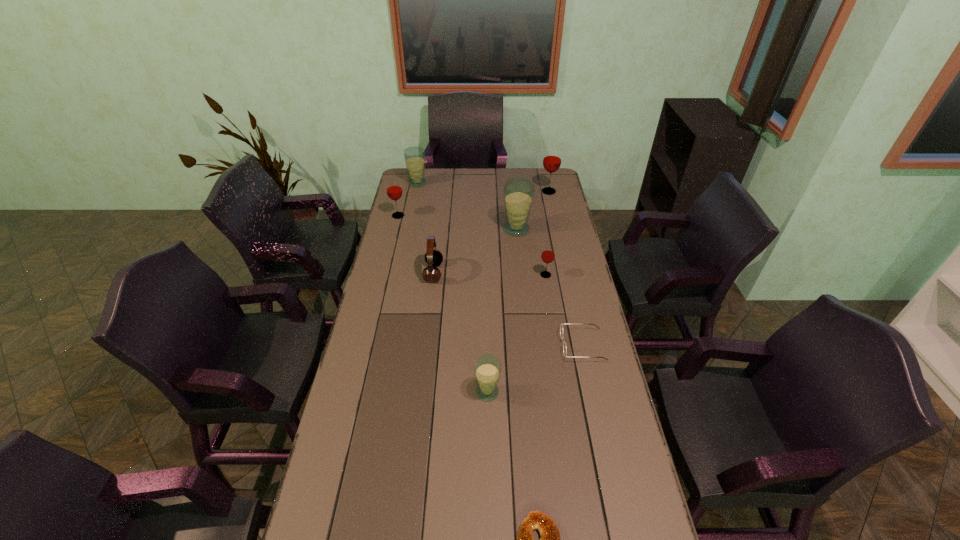
Image resolution: width=960 pixels, height=540 pixels. I want to click on glass that stands as the third closest to the second biggest blue glass, so click(552, 158).

Identify which glass is located as the fifth nearest to the spectacles. Please provide its 2D coordinates. Your answer should be formatted as a tuple, i.e. [(x, y)], where the tuple contains the x and y coordinates of a point satisfying the conditions above.

[(394, 191)]

The width and height of the screenshot is (960, 540). What are the coordinates of `red glass that is the nearest to the farthest red glass` in the screenshot? It's located at (548, 253).

Choose which red glass is the second nearest neighbor to the second nearest red glass. Please provide its 2D coordinates. Your answer should be formatted as a tuple, i.e. [(x, y)], where the tuple contains the x and y coordinates of a point satisfying the conditions above.

[(548, 253)]

At what (x,y) coordinates should I click in order to perform the action: click on blue glass object that ranks as the closest to the black spectacles. Please return your answer as a coordinate pair (x, y). Looking at the image, I should click on (487, 368).

You are a GUI agent. You are given a task and a screenshot of the screen. Output one action in this format:
    pyautogui.click(x=<x>, y=<y>)
    Task: Click on the blue glass identified as the third closest to the second red glass from left to right
    This screenshot has width=960, height=540.
    Given the screenshot: What is the action you would take?
    pyautogui.click(x=414, y=156)

The image size is (960, 540). Find the location of `free spot that satisfies the following two spatial constraints: 1. on the ear pads of the headset; 2. on the left side of the smallest blue glass`. free spot that satisfies the following two spatial constraints: 1. on the ear pads of the headset; 2. on the left side of the smallest blue glass is located at coordinates (420, 392).

What are the coordinates of `free location that satisfies the following two spatial constraints: 1. on the front side of the fourth glass from left to right; 2. on the right side of the second smallest blue glass` in the screenshot? It's located at (408, 230).

This screenshot has height=540, width=960. Find the location of `free location that satisfies the following two spatial constraints: 1. on the front side of the biggest blue glass; 2. on the right side of the second biggest blue glass`. free location that satisfies the following two spatial constraints: 1. on the front side of the biggest blue glass; 2. on the right side of the second biggest blue glass is located at coordinates (408, 230).